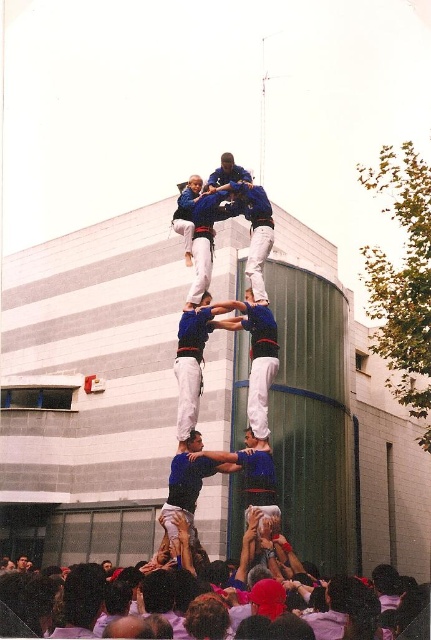
Question: Which of the following is the closest to the observer?

Choices:
 (A) (184, 436)
 (B) (91, 616)

Answer: (B)

Question: Which of the following is the farthest from the observer?

Choices:
 (A) blue fabric pants at center
 (B) white cotton shirt at lower center
 (C) blue fabric person at center

Answer: (A)

Question: Can you confirm if white cotton shirt at lower center is positioned to the right of blue fabric pants at center?

Choices:
 (A) yes
 (B) no

Answer: (A)

Question: Which point appears closest to the camera in this image?

Choices:
 (A) (171, 483)
 (B) (190, 326)

Answer: (A)

Question: Is white cotton shirt at lower center to the right of blue fabric pants at center from the viewer's perspective?

Choices:
 (A) no
 (B) yes

Answer: (B)

Question: Considering the relative positions of white cotton shirt at lower center and blue fabric pants at center in the image provided, where is white cotton shirt at lower center located with respect to blue fabric pants at center?

Choices:
 (A) below
 (B) above

Answer: (A)